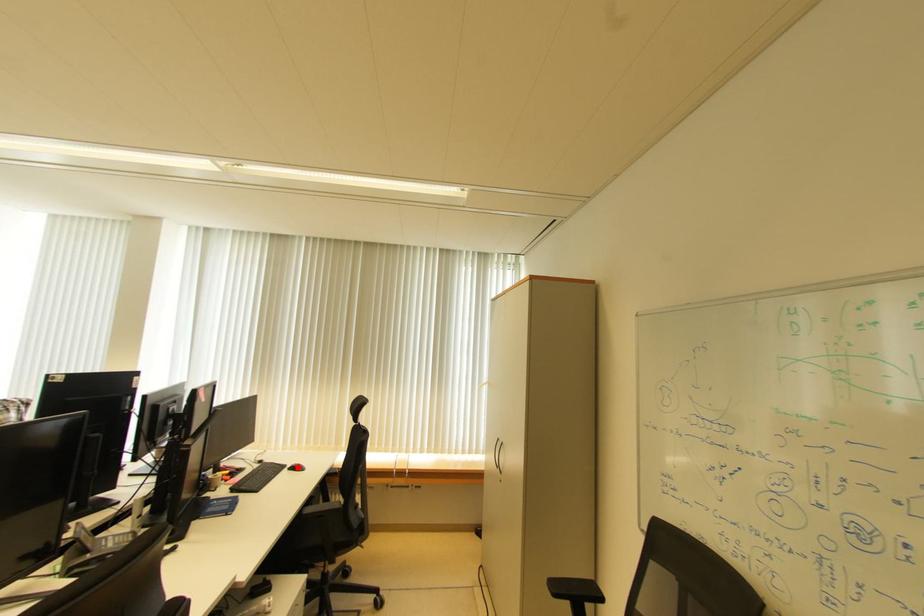
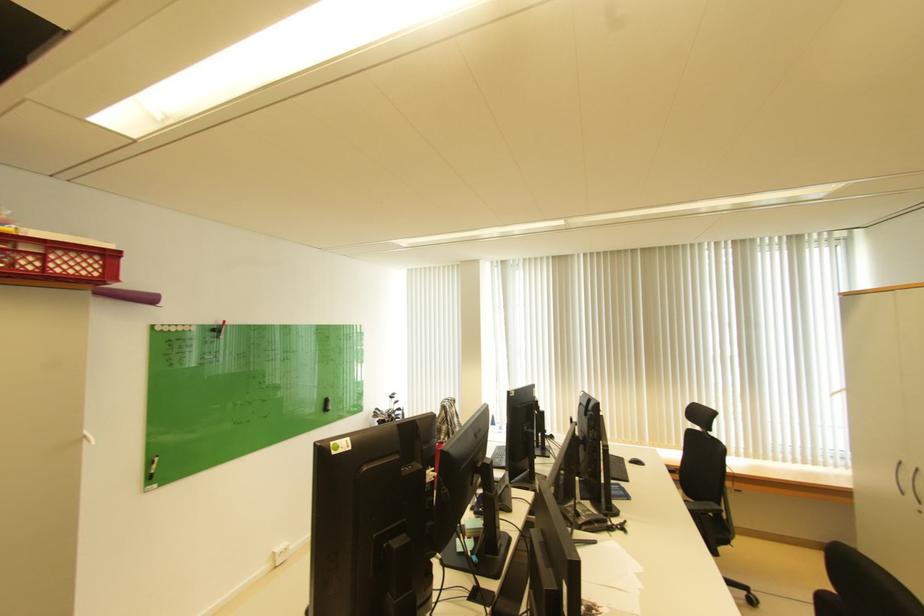
The point at the highlighted location is marked in the first image. Where is the corresponding point in the second image?

(638, 461)